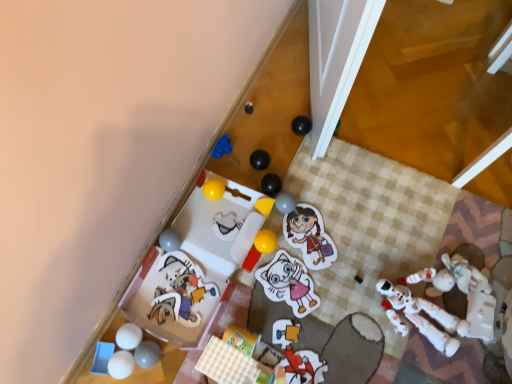
Locate an element on the screen. The height and width of the screenshot is (384, 512). free space between white rubber ball at lower left, which is the fourteenth toy from right to left, and white matte cat at center, which is counted as the 2th toy, starting from the right is located at coordinates (214, 324).